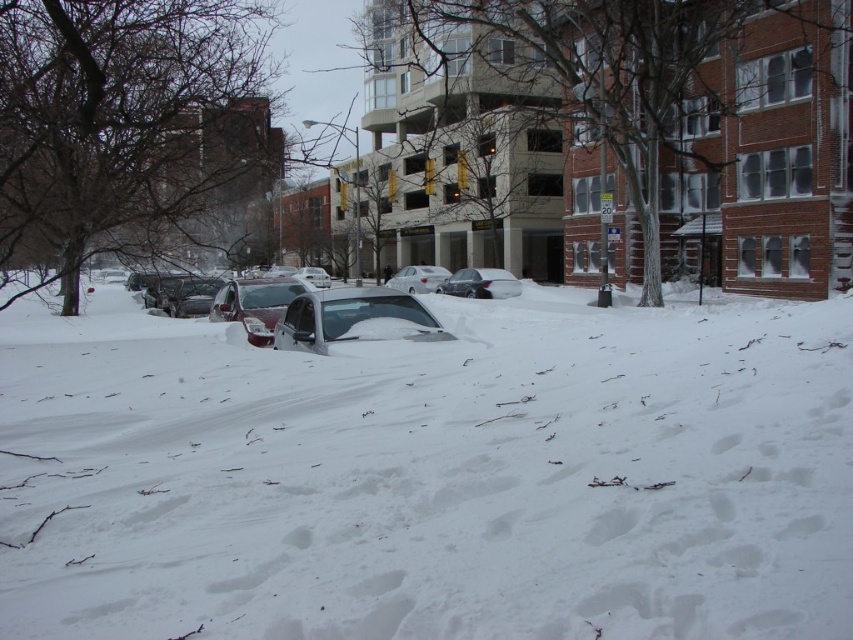
You are a city planner analyzing the snow coverage in the image. Based on the scene, which object takes up more space in the image between the white fluffy snow at center and the metallic silver sedan at center?

The white fluffy snow at center takes up more space in the image than the metallic silver sedan at center because it is described as bigger.

You are standing in the snowy urban scene and want to walk from point A to point B. Point A is at coordinates point (599, 403) and point B is at coordinates point (473, 280). Which point is closer to you, point A or point B?

Point A at coordinates point (599, 403) is closer to you than point B at coordinates point (473, 280).

You are standing in the snowy urban scene and notice the white fluffy snow at center and the metallic silver sedan at center. From your perspective, which object is positioned to the right of the other?

The white fluffy snow at center is to the right of the metallic silver sedan at center.